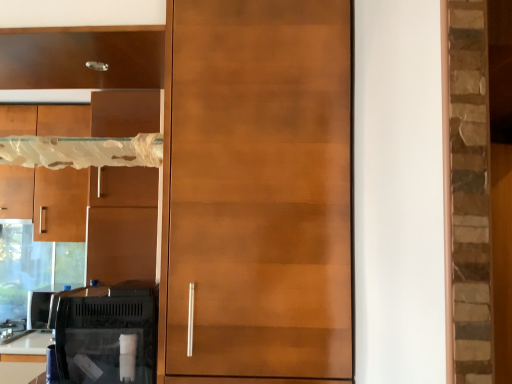
Question: Can you confirm if matte wood cabinet at upper left, the 2th cabinetry in the bottom-to-top sequence, is positioned to the left of glossy wood door at center?

Choices:
 (A) yes
 (B) no

Answer: (A)

Question: Is matte wood cabinet at upper left, positioned as the 1th cabinetry in front-to-back order, aimed at glossy wood door at center?

Choices:
 (A) no
 (B) yes

Answer: (A)

Question: Does matte wood cabinet at upper left, positioned as the 1th cabinetry in front-to-back order, have a greater height compared to glossy wood door at center?

Choices:
 (A) yes
 (B) no

Answer: (B)

Question: Is matte wood cabinet at upper left, the first cabinetry viewed from the top, outside of glossy wood door at center?

Choices:
 (A) no
 (B) yes

Answer: (B)

Question: Is matte wood cabinet at upper left, acting as the second cabinetry starting from the left, closer to camera compared to glossy wood door at center?

Choices:
 (A) yes
 (B) no

Answer: (B)

Question: From the image's perspective, relative to glossy wood door at center, is matte brown cabinet at left, the 1th cabinetry positioned from the back, above or below?

Choices:
 (A) above
 (B) below

Answer: (B)

Question: Is matte brown cabinet at left, positioned as the first cabinetry in left-to-right order, spatially inside glossy wood door at center, or outside of it?

Choices:
 (A) inside
 (B) outside

Answer: (B)

Question: Is point (52, 233) closer or farther from the camera than point (251, 203)?

Choices:
 (A) farther
 (B) closer

Answer: (A)

Question: From their relative heights in the image, would you say matte brown cabinet at left, positioned as the second cabinetry in top-to-bottom order, is taller or shorter than glossy wood door at center?

Choices:
 (A) tall
 (B) short

Answer: (B)

Question: From the image's perspective, is matte wood cabinet at upper left, acting as the second cabinetry starting from the left, above or below glossy wood door at center?

Choices:
 (A) above
 (B) below

Answer: (A)

Question: In the image, is matte wood cabinet at upper left, the 2th cabinetry in the bottom-to-top sequence, positioned in front of or behind glossy wood door at center?

Choices:
 (A) behind
 (B) front

Answer: (A)

Question: Considering the positions of matte wood cabinet at upper left, the first cabinetry viewed from the top, and glossy wood door at center in the image, is matte wood cabinet at upper left, the first cabinetry viewed from the top, taller or shorter than glossy wood door at center?

Choices:
 (A) short
 (B) tall

Answer: (A)

Question: Considering the positions of matte wood cabinet at upper left, the first cabinetry viewed from the top, and glossy wood door at center in the image, is matte wood cabinet at upper left, the first cabinetry viewed from the top, wider or thinner than glossy wood door at center?

Choices:
 (A) thin
 (B) wide

Answer: (A)

Question: Is glossy wood door at center to the left or to the right of matte brown cabinet at left, which appears as the second cabinetry when viewed from the right, in the image?

Choices:
 (A) right
 (B) left

Answer: (A)

Question: Do you think glossy wood door at center is within matte brown cabinet at left, which is counted as the first cabinetry, starting from the bottom, or outside of it?

Choices:
 (A) outside
 (B) inside

Answer: (A)